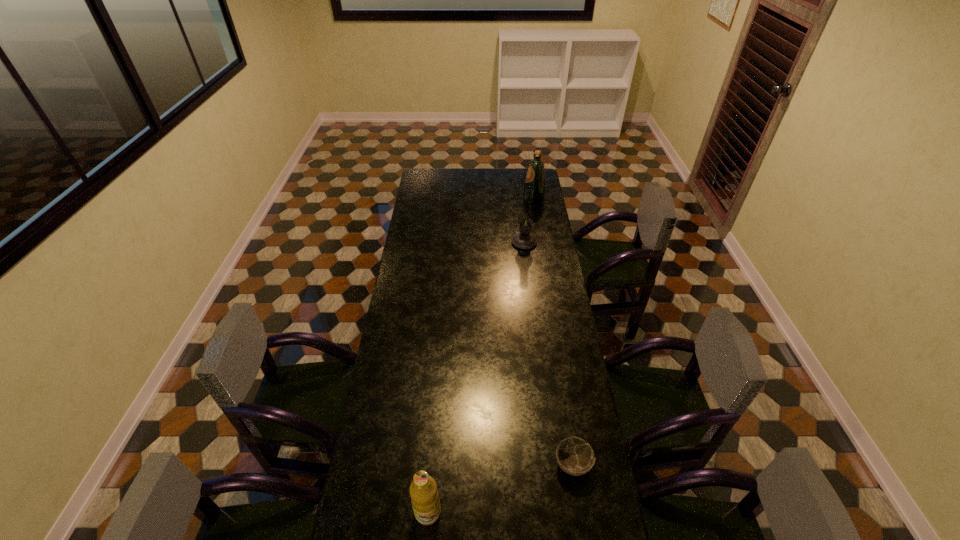
Find the location of a particular element. The height and width of the screenshot is (540, 960). free area in between the third tallest object and the farthest object is located at coordinates (481, 355).

At what (x,y) coordinates should I click in order to perform the action: click on free space between the shortest object and the oil lamp. Please return your answer as a coordinate pair (x, y). Looking at the image, I should click on click(x=548, y=353).

Where is `unoccupied area between the leftmost object and the second nearest object`? unoccupied area between the leftmost object and the second nearest object is located at coordinates (500, 488).

Where is `object that is the nearest to the leftmost object`? The width and height of the screenshot is (960, 540). object that is the nearest to the leftmost object is located at coordinates (574, 456).

Where is `the second closest object to the oil lamp`? Image resolution: width=960 pixels, height=540 pixels. the second closest object to the oil lamp is located at coordinates (574, 456).

Find the location of a particular element. This screenshot has height=540, width=960. vacant space that satisfies the following two spatial constraints: 1. on the front-facing side of the farther olive oil; 2. on the label of the nearest object is located at coordinates (584, 512).

Identify the location of free space that satisfies the following two spatial constraints: 1. on the front-facing side of the farthest object; 2. on the label of the nearest object. Image resolution: width=960 pixels, height=540 pixels. (584, 512).

Find the location of `vacant area in the image that satisfies the following two spatial constraints: 1. on the front-facing side of the farther olive oil; 2. on the label of the nearest object`. vacant area in the image that satisfies the following two spatial constraints: 1. on the front-facing side of the farther olive oil; 2. on the label of the nearest object is located at coordinates coord(584,512).